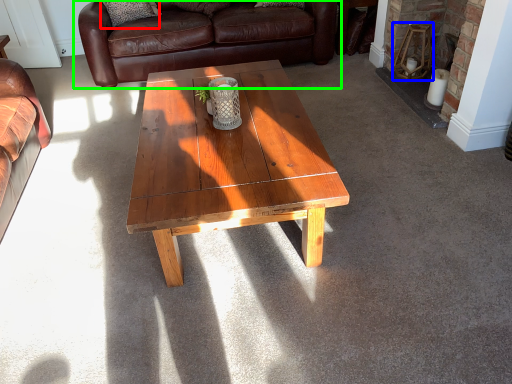
Question: Considering the real-world distances, which object is farthest from pillow (highlighted by a red box)? stool (highlighted by a blue box) or studio couch (highlighted by a green box)?

Choices:
 (A) stool
 (B) studio couch

Answer: (A)